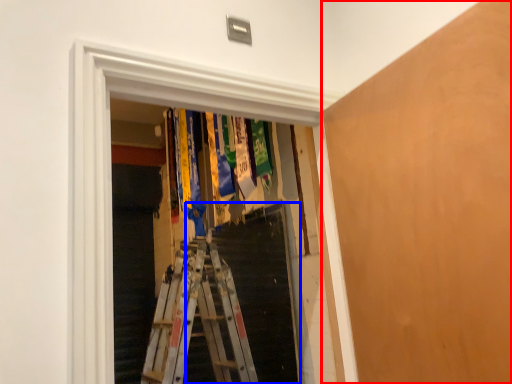
Question: Which object is further to the camera taking this photo, plywood (highlighted by a red box) or stairs (highlighted by a blue box)?

Choices:
 (A) plywood
 (B) stairs

Answer: (B)